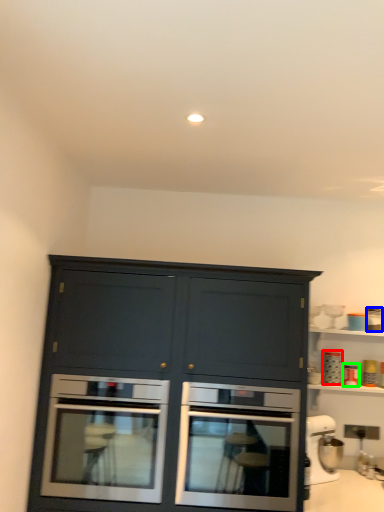
Question: Which is nearer to the appliance (highlighted by a red box)? appliance (highlighted by a blue box) or appliance (highlighted by a green box).

Choices:
 (A) appliance
 (B) appliance

Answer: (B)